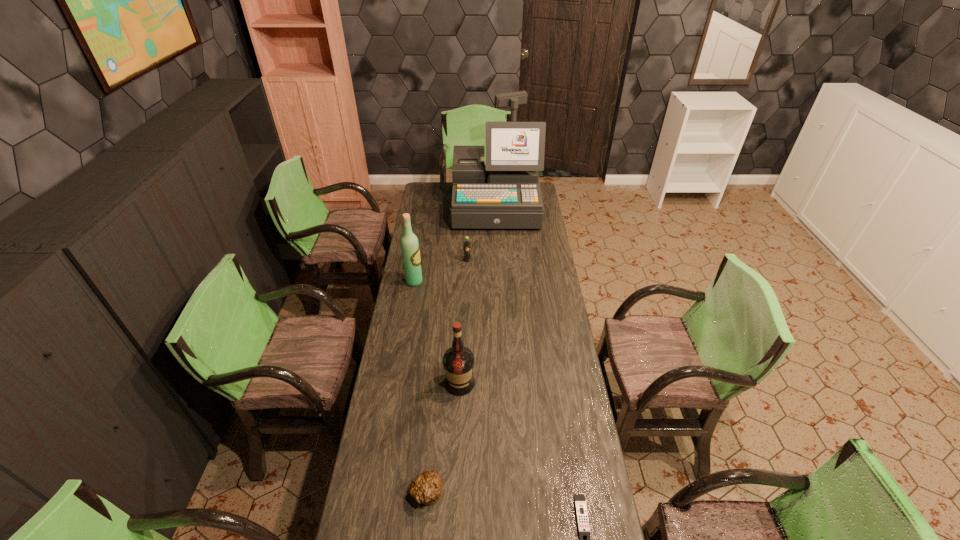
Where is `free space at the left edge of the desktop`? This screenshot has height=540, width=960. free space at the left edge of the desktop is located at coordinates (410, 320).

In the image, there is a desktop. Identify the location of vacant space at the right edge. The image size is (960, 540). (526, 234).

The width and height of the screenshot is (960, 540). In the image, there is a desktop. Find the location of `blank space at the far left corner`. blank space at the far left corner is located at coordinates (438, 187).

This screenshot has height=540, width=960. In order to click on vacant space that's between the cash register and the fourth tallest object in this screenshot , I will do `click(482, 233)`.

This screenshot has height=540, width=960. I want to click on free space between the liquor and the muffin, so click(444, 438).

The height and width of the screenshot is (540, 960). What are the coordinates of `free spot between the fifth nearest object and the third tallest object` in the screenshot? It's located at (464, 322).

Find the location of a particular element. The height and width of the screenshot is (540, 960). free spot between the muffin and the leftmost object is located at coordinates (420, 387).

Image resolution: width=960 pixels, height=540 pixels. I want to click on vacant space that's between the fourth farthest object and the tallest object, so coord(478,294).

You are a GUI agent. You are given a task and a screenshot of the screen. Output one action in this format:
    pyautogui.click(x=<x>, y=<y>)
    Task: Click on the third closest object to the remote control
    
    Given the screenshot: What is the action you would take?
    pyautogui.click(x=409, y=244)

Choose which object is the fourth nearest neighbor to the soda. Please provide its 2D coordinates. Your answer should be formatted as a tuple, i.e. [(x, y)], where the tuple contains the x and y coordinates of a point satisfying the conditions above.

[(426, 488)]